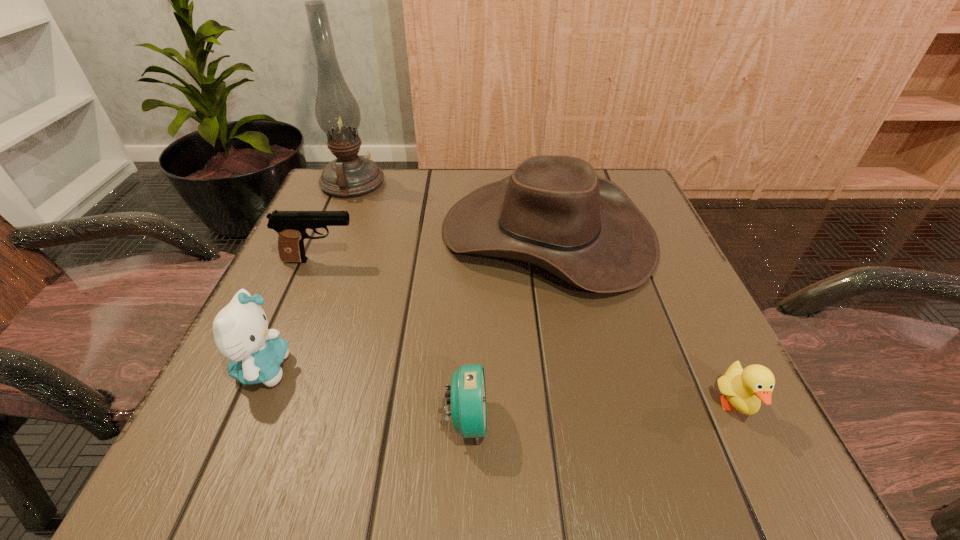
At what (x,y) coordinates should I click in order to perform the action: click on duckling that is positioned at the right edge. Please return your answer as a coordinate pair (x, y). The width and height of the screenshot is (960, 540). Looking at the image, I should click on (745, 389).

This screenshot has width=960, height=540. Identify the location of object at the far left corner. (337, 112).

Where is `object present at the far right corner`? The height and width of the screenshot is (540, 960). object present at the far right corner is located at coordinates (553, 211).

Where is `object that is at the near right corner`? object that is at the near right corner is located at coordinates (745, 389).

At what (x,y) coordinates should I click in order to perform the action: click on vacant space at the far edge of the desktop. Please return your answer as a coordinate pair (x, y). Image resolution: width=960 pixels, height=540 pixels. Looking at the image, I should click on (397, 174).

Locate an element on the screen. The image size is (960, 540). free region at the near edge of the desktop is located at coordinates (536, 427).

Where is `free point at the left edge`? free point at the left edge is located at coordinates (304, 364).

Where is `free location at the right edge of the desktop`? This screenshot has width=960, height=540. free location at the right edge of the desktop is located at coordinates (701, 388).

Where is `free point between the alarm clock and the duckling`? free point between the alarm clock and the duckling is located at coordinates (601, 413).

This screenshot has height=540, width=960. Find the location of `free point between the pistol and the cowboy hat`. free point between the pistol and the cowboy hat is located at coordinates [x=434, y=247].